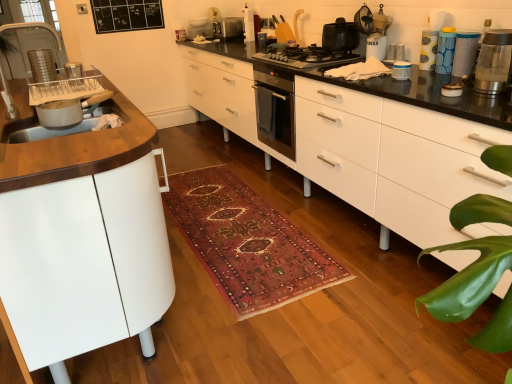
Where is `free space above carpeted rug at center (from a real-world perspective)`? free space above carpeted rug at center (from a real-world perspective) is located at coordinates (236, 221).